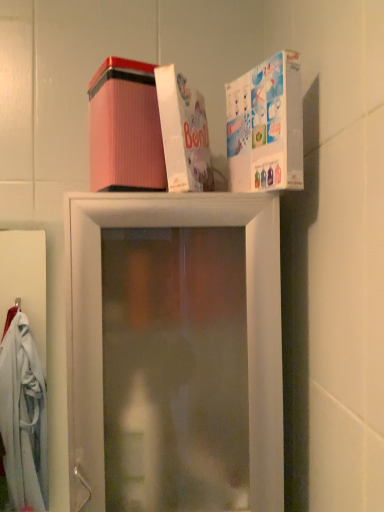
Question: Is white cardboard box at upper center, which is the second box in left-to-right order, far away from white glossy box at upper right, which is the first box in right-to-left order?

Choices:
 (A) no
 (B) yes

Answer: (A)

Question: Is white cardboard box at upper center, which is the second box in left-to-right order, positioned in front of white glossy box at upper right, the 3th box viewed from the left?

Choices:
 (A) no
 (B) yes

Answer: (A)

Question: Can you confirm if white cardboard box at upper center, which is the second box in left-to-right order, is taller than white glossy box at upper right, the 3th box viewed from the left?

Choices:
 (A) yes
 (B) no

Answer: (A)

Question: From the image's perspective, is white cardboard box at upper center, which is the second box in left-to-right order, over white glossy box at upper right, which is the first box in right-to-left order?

Choices:
 (A) no
 (B) yes

Answer: (B)

Question: Is white cardboard box at upper center, placed as the 2th box when sorted from right to left, further to camera compared to white glossy box at upper right, the 3th box viewed from the left?

Choices:
 (A) yes
 (B) no

Answer: (A)

Question: Is white glossy box at upper right, which is the first box in right-to-left order, bigger or smaller than transparent plastic shelf at upper center?

Choices:
 (A) big
 (B) small

Answer: (B)

Question: From the image's perspective, is white glossy box at upper right, which is the first box in right-to-left order, above or below transparent plastic shelf at upper center?

Choices:
 (A) above
 (B) below

Answer: (A)

Question: From a real-world perspective, is white glossy box at upper right, which is the first box in right-to-left order, above or below transparent plastic shelf at upper center?

Choices:
 (A) below
 (B) above

Answer: (B)

Question: Do you think white glossy box at upper right, the 3th box viewed from the left, is within transparent plastic shelf at upper center, or outside of it?

Choices:
 (A) inside
 (B) outside

Answer: (B)

Question: Considering the positions of transparent plastic shelf at upper center and white cardboard box at upper center, placed as the 2th box when sorted from right to left, in the image, is transparent plastic shelf at upper center bigger or smaller than white cardboard box at upper center, placed as the 2th box when sorted from right to left,?

Choices:
 (A) big
 (B) small

Answer: (A)

Question: In terms of height, does transparent plastic shelf at upper center look taller or shorter compared to white cardboard box at upper center, which is the second box in left-to-right order?

Choices:
 (A) tall
 (B) short

Answer: (A)

Question: Is transparent plastic shelf at upper center wider or thinner than white cardboard box at upper center, which is the second box in left-to-right order?

Choices:
 (A) wide
 (B) thin

Answer: (A)

Question: Considering the positions of point (102, 504) and point (203, 126), is point (102, 504) closer or farther from the camera than point (203, 126)?

Choices:
 (A) farther
 (B) closer

Answer: (B)

Question: From the image's perspective, is pink corrugated box at upper center, the first box positioned from the left, above or below white cardboard box at upper center, placed as the 2th box when sorted from right to left?

Choices:
 (A) below
 (B) above

Answer: (A)

Question: In terms of size, does pink corrugated box at upper center, the first box positioned from the left, appear bigger or smaller than white cardboard box at upper center, placed as the 2th box when sorted from right to left?

Choices:
 (A) small
 (B) big

Answer: (B)